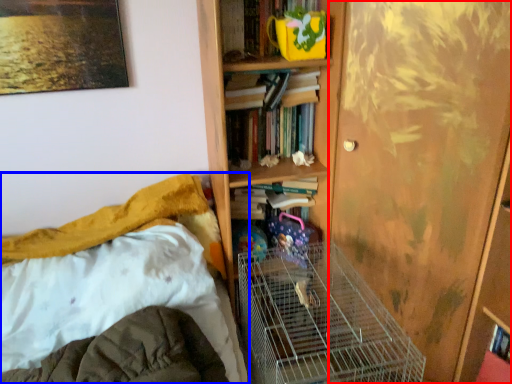
Question: Which of the following is the farthest to the observer, screen door (highlighted by a red box) or bed (highlighted by a blue box)?

Choices:
 (A) screen door
 (B) bed

Answer: (A)